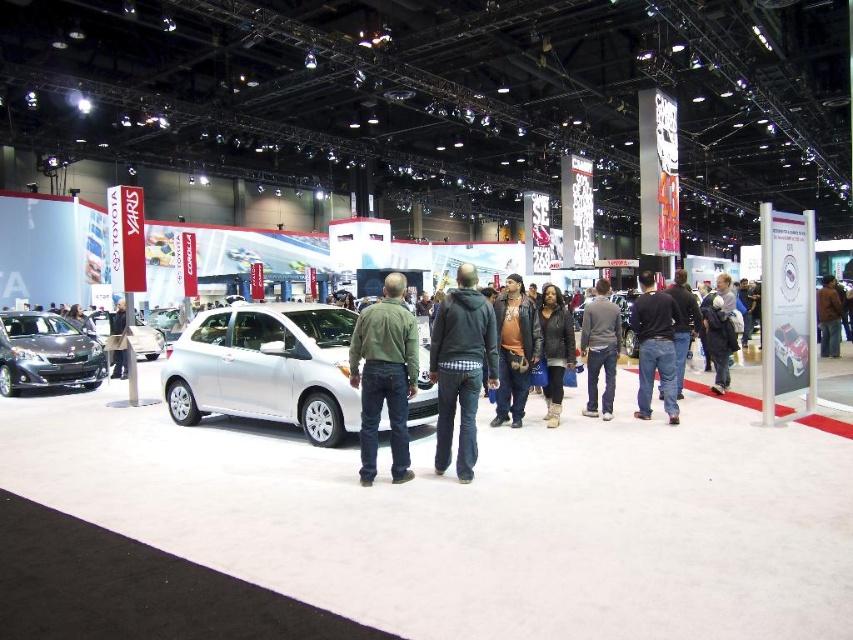
Which is more to the right, leather jacket at center or denim jeans at center?

Positioned to the right is denim jeans at center.

Between leather jacket at center and denim jeans at center, which one is positioned higher?

denim jeans at center is above.

Between point (526, 388) and point (677, 369), which one is positioned behind?

Point (677, 369)

Locate an element on the screen. The image size is (853, 640). leather jacket at center is located at coordinates (514, 352).

Who is more forward, (514, 337) or (605, 401)?

Point (514, 337)

Can you confirm if leather jacket at center is thinner than gray cotton hoodie at center?

Correct, leather jacket at center's width is less than gray cotton hoodie at center's.

Is point (532, 348) closer to viewer compared to point (596, 312)?

Yes, it is.

Identify the location of leather jacket at center. The width and height of the screenshot is (853, 640). (514, 352).

Who is positioned more to the right, green matte jacket at center or dark blue denim jacket at center?

dark blue denim jacket at center is more to the right.

In the scene shown: Is green matte jacket at center positioned at the back of dark blue denim jacket at center?

No, it is not.

Between point (360, 403) and point (724, 328), which one is positioned in front?

Point (360, 403)

Find the location of `green matte jacket at center`. green matte jacket at center is located at coordinates (384, 376).